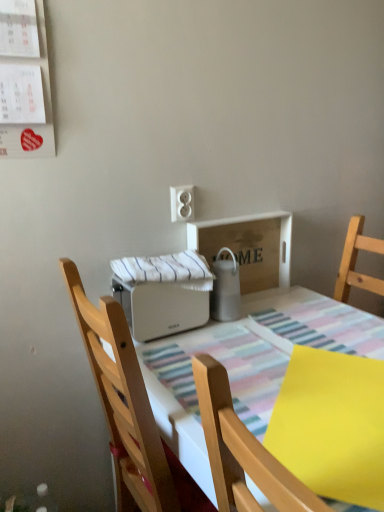
At what (x,y) coordinates should I click in order to perform the action: click on free area in between wooden tray at center and satin silver thermos at center, which is the 2th appliance in left-to-right order. Please return your answer as a coordinate pair (x, y). Looking at the image, I should click on (259, 306).